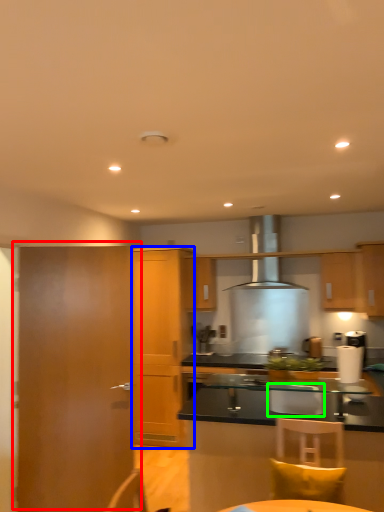
Question: Which is nearer to the door (highlighted by a red box)? cabinetry (highlighted by a blue box) or armchair (highlighted by a green box).

Choices:
 (A) cabinetry
 (B) armchair

Answer: (B)